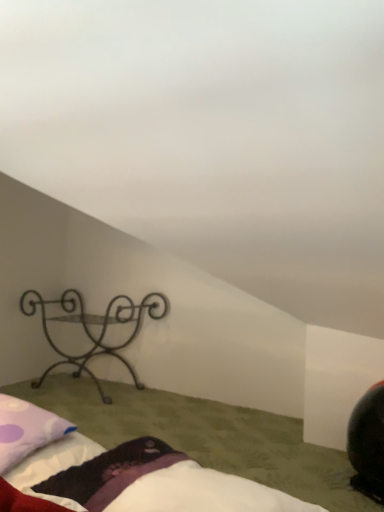
The image size is (384, 512). Identify the location of vacant region above fluffy white bed at lower center (from a real-world perspective). (165, 416).